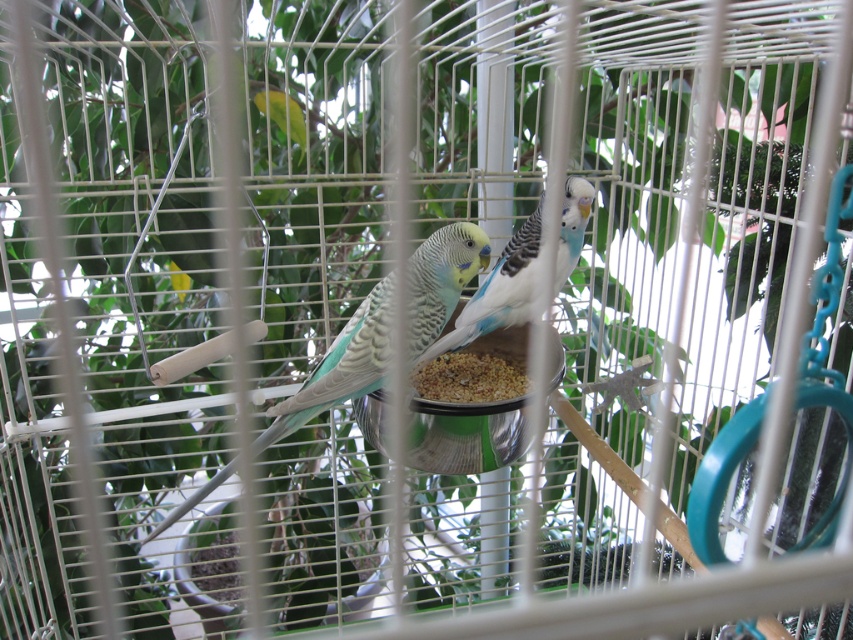
Can you confirm if speckled teal parrot at center is wider than metallic silver bird feeder at center?

Incorrect, speckled teal parrot at center's width does not surpass metallic silver bird feeder at center's.

Is point (297, 396) farther from camera compared to point (488, 424)?

No, (297, 396) is closer to viewer.

Identify the location of speckled teal parrot at center. The height and width of the screenshot is (640, 853). (340, 365).

Does speckled teal parrot at center appear over blue and white parrot at center?

No.

Does speckled teal parrot at center appear under blue and white parrot at center?

Yes.

Where is `speckled teal parrot at center`? speckled teal parrot at center is located at coordinates (340, 365).

Is blue and white parrot at center thinner than brown grainy food at center?

Incorrect, blue and white parrot at center's width is not less than brown grainy food at center's.

Which is more to the right, blue and white parrot at center or brown grainy food at center?

Positioned to the right is blue and white parrot at center.

I want to click on blue and white parrot at center, so click(x=498, y=291).

The height and width of the screenshot is (640, 853). What are the coordinates of `blue and white parrot at center` in the screenshot? It's located at (498, 291).